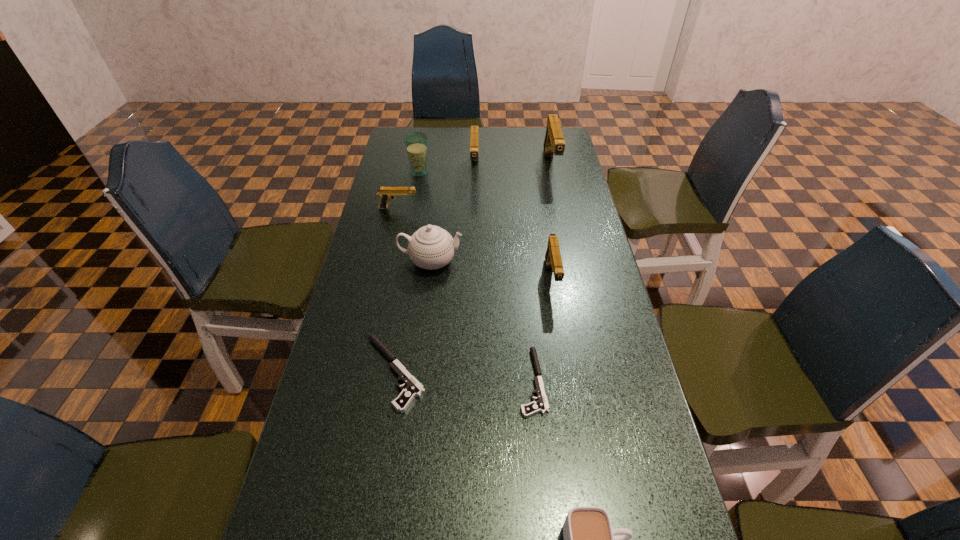
Where is `the third closest pistol relative to the fourth pistol from right to left`? Image resolution: width=960 pixels, height=540 pixels. the third closest pistol relative to the fourth pistol from right to left is located at coordinates (553, 259).

What are the coordinates of `tan pistol that can be found as the third closest to the shortest pistol` in the screenshot? It's located at (474, 136).

Where is `tan pistol that is the third nearest to the chinaware`? The width and height of the screenshot is (960, 540). tan pistol that is the third nearest to the chinaware is located at coordinates (474, 136).

Identify which black pistol is the nearest to the chinaware. Please provide its 2D coordinates. Your answer should be formatted as a tuple, i.e. [(x, y)], where the tuple contains the x and y coordinates of a point satisfying the conditions above.

[(413, 389)]

Locate an element on the screen. vacant area in the image that satisfies the following two spatial constraints: 1. at the barrel of the fifth shortest pistol; 2. on the front-facing side of the second shortest object is located at coordinates (471, 373).

Where is `free point that satisfies the following two spatial constraints: 1. at the barrel of the fifth object from left to right; 2. on the spout of the chinaware`? The height and width of the screenshot is (540, 960). free point that satisfies the following two spatial constraints: 1. at the barrel of the fifth object from left to right; 2. on the spout of the chinaware is located at coordinates (473, 261).